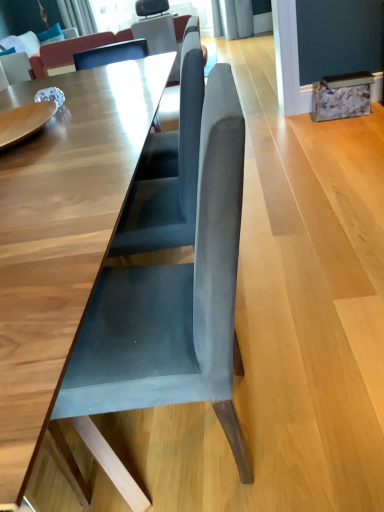
Question: From the image's perspective, is suede couch at upper center, which is the 1th couch in front-to-back order, positioned above or below velvet blue couch at upper left, placed as the 2th couch when sorted from right to left?

Choices:
 (A) below
 (B) above

Answer: (A)

Question: Is point (61, 53) positioned closer to the camera than point (23, 39)?

Choices:
 (A) closer
 (B) farther

Answer: (B)

Question: Which is nearer to the velvet blue couch at upper left, arranged as the second couch when viewed from the front?

Choices:
 (A) suede couch at upper center, placed as the second couch when sorted from left to right
 (B) suede gray chair at center

Answer: (A)

Question: Which object is positioned farthest from the suede couch at upper center, placed as the second couch when sorted from left to right?

Choices:
 (A) suede gray chair at center
 (B) velvet blue couch at upper left, arranged as the second couch when viewed from the front

Answer: (A)